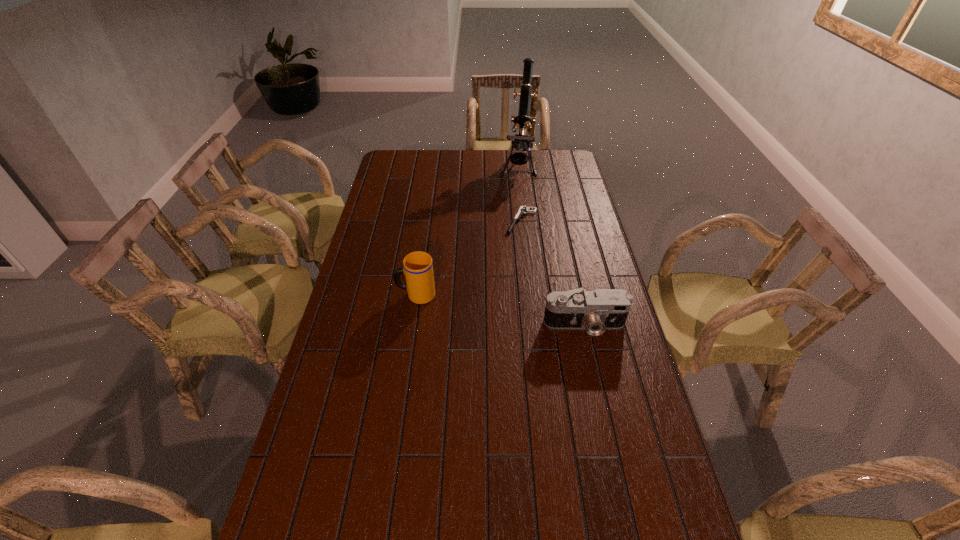
Image resolution: width=960 pixels, height=540 pixels. I want to click on vacant space situated on the front-facing side of the third nearest object, so click(512, 244).

Locate an element on the screen. The width and height of the screenshot is (960, 540). vacant region located 0.240m on the front-facing side of the third nearest object is located at coordinates (497, 272).

This screenshot has width=960, height=540. Identify the location of vacant area located on the front-facing side of the third nearest object. (504, 260).

Where is `vacant space situated 0.050m through the eyepiece of the farthest object`? vacant space situated 0.050m through the eyepiece of the farthest object is located at coordinates (516, 192).

Where is `vacant space located through the eyepiece of the farthest object`? This screenshot has width=960, height=540. vacant space located through the eyepiece of the farthest object is located at coordinates (512, 217).

I want to click on vacant space located 0.070m through the eyepiece of the farthest object, so click(516, 194).

Where is `object located at the far edge`? This screenshot has height=540, width=960. object located at the far edge is located at coordinates (521, 142).

Image resolution: width=960 pixels, height=540 pixels. In order to click on object present at the right edge in this screenshot , I will do tap(595, 311).

Find the location of a particular element. vacant space at the far edge of the desktop is located at coordinates (484, 159).

Identify the location of blank area at the near edge. This screenshot has height=540, width=960. click(x=445, y=526).